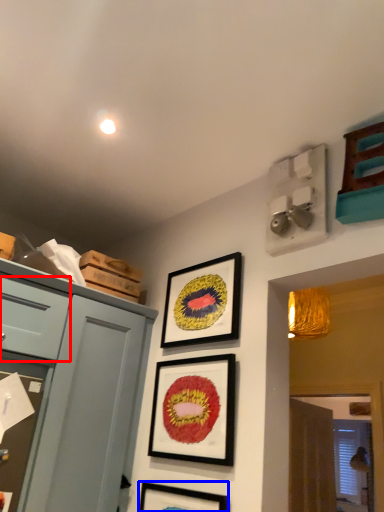
Question: Which object appears closest to the camera in this image, drawer (highlighted by a red box) or picture frame (highlighted by a blue box)?

Choices:
 (A) drawer
 (B) picture frame

Answer: (B)